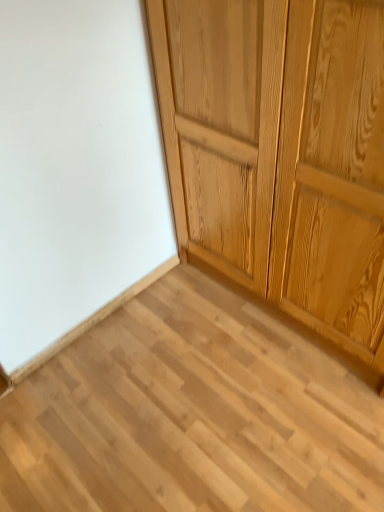
I want to click on empty space that is ontop of light wood plank at center (from a real-world perspective), so click(197, 411).